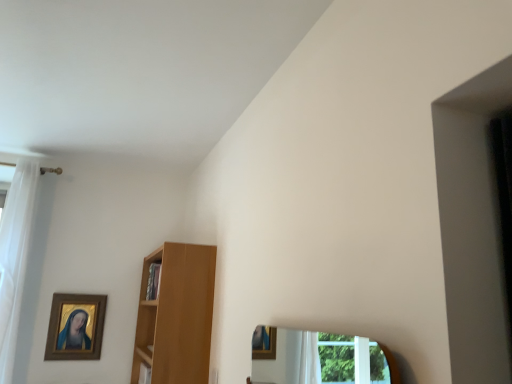
Question: Is wooden cabinet at center not inside gold-framed painting at upper left?

Choices:
 (A) no
 (B) yes

Answer: (B)

Question: Is wooden cabinet at center wider than gold-framed painting at upper left?

Choices:
 (A) no
 (B) yes

Answer: (B)

Question: Does wooden cabinet at center have a larger size compared to gold-framed painting at upper left?

Choices:
 (A) yes
 (B) no

Answer: (A)

Question: Does wooden cabinet at center appear on the right side of gold-framed painting at upper left?

Choices:
 (A) no
 (B) yes

Answer: (B)

Question: Is there a large distance between wooden cabinet at center and gold-framed painting at upper left?

Choices:
 (A) no
 (B) yes

Answer: (A)

Question: Is the depth of wooden cabinet at center less than that of gold-framed painting at upper left?

Choices:
 (A) yes
 (B) no

Answer: (A)

Question: From a real-world perspective, is light brown wooden shelf at center physically below white sheer curtain at left?

Choices:
 (A) yes
 (B) no

Answer: (A)

Question: From a real-world perspective, is light brown wooden shelf at center physically above white sheer curtain at left?

Choices:
 (A) no
 (B) yes

Answer: (A)

Question: Does light brown wooden shelf at center have a lesser height compared to white sheer curtain at left?

Choices:
 (A) no
 (B) yes

Answer: (B)

Question: Is light brown wooden shelf at center with white sheer curtain at left?

Choices:
 (A) no
 (B) yes

Answer: (A)

Question: Would you say light brown wooden shelf at center is outside white sheer curtain at left?

Choices:
 (A) yes
 (B) no

Answer: (A)

Question: Could you tell me if light brown wooden shelf at center is facing white sheer curtain at left?

Choices:
 (A) yes
 (B) no

Answer: (A)

Question: Is gold-framed painting at upper left located outside white sheer curtain at left?

Choices:
 (A) no
 (B) yes

Answer: (B)